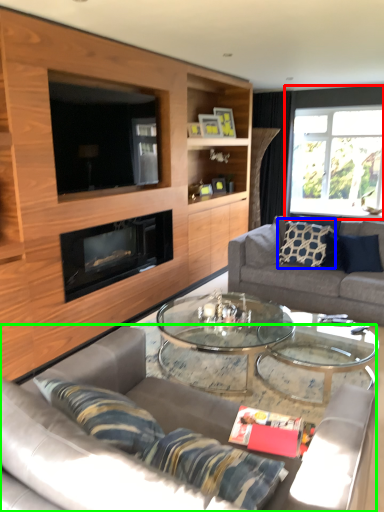
Question: Based on their relative distances, which object is farther from window (highlighted by a red box)? Choose from pillow (highlighted by a blue box) and studio couch (highlighted by a green box).

Choices:
 (A) pillow
 (B) studio couch

Answer: (B)